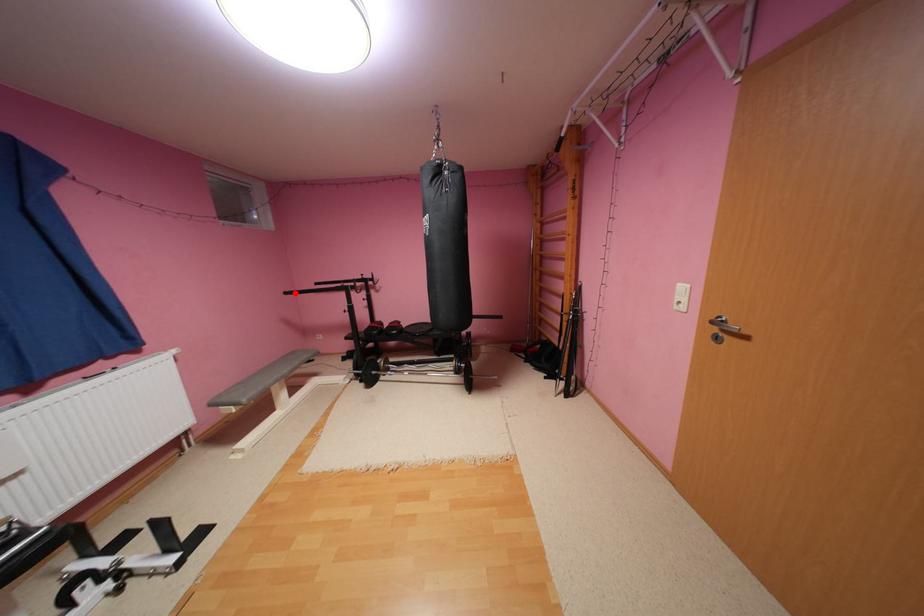
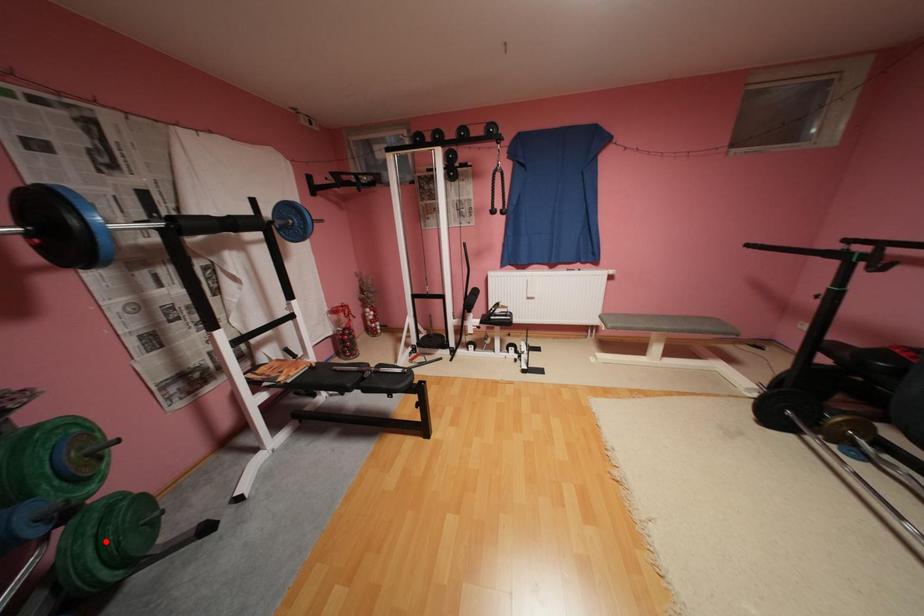
I am providing you with two images of the same scene from different viewpoints. A red point is marked on the first image and another point is marked on the second image. Is the marked point in image1 the same physical position as the marked point in image2?

No